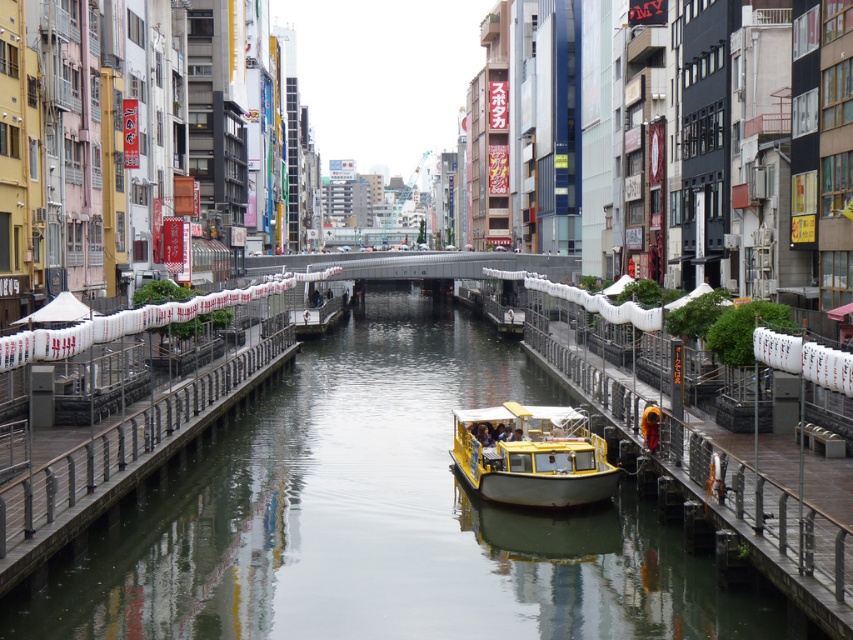
Does smooth concrete river at center come behind yellow matte boat at center?

That is False.

Who is shorter, smooth concrete river at center or yellow matte boat at center?

Standing shorter between the two is yellow matte boat at center.

The width and height of the screenshot is (853, 640). What do you see at coordinates (378, 518) in the screenshot?
I see `smooth concrete river at center` at bounding box center [378, 518].

You are a GUI agent. You are given a task and a screenshot of the screen. Output one action in this format:
    pyautogui.click(x=<x>, y=<y>)
    Task: Click on the smooth concrete river at center
    Image resolution: width=853 pixels, height=640 pixels.
    Given the screenshot: What is the action you would take?
    pyautogui.click(x=378, y=518)

Can you confirm if wooden rail at left is positioned below yellow matte boat at center?

Incorrect, wooden rail at left is not positioned below yellow matte boat at center.

Does point (270, 342) come in front of point (608, 493)?

No, (270, 342) is further to viewer.

Where is `wooden rail at left`? wooden rail at left is located at coordinates (126, 449).

Between point (239, 413) and point (276, 348), which one is positioned behind?

The point (276, 348) is behind.

Is smooth concrete river at center closer to camera compared to wooden rail at left?

No.

Does point (184, 620) lie in front of point (112, 438)?

Yes.

Locate an element on the screen. smooth concrete river at center is located at coordinates pos(378,518).